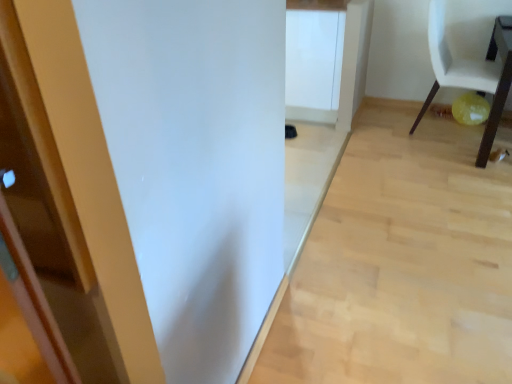
The width and height of the screenshot is (512, 384). I want to click on free space to the left of wooden table at lower right, so click(417, 150).